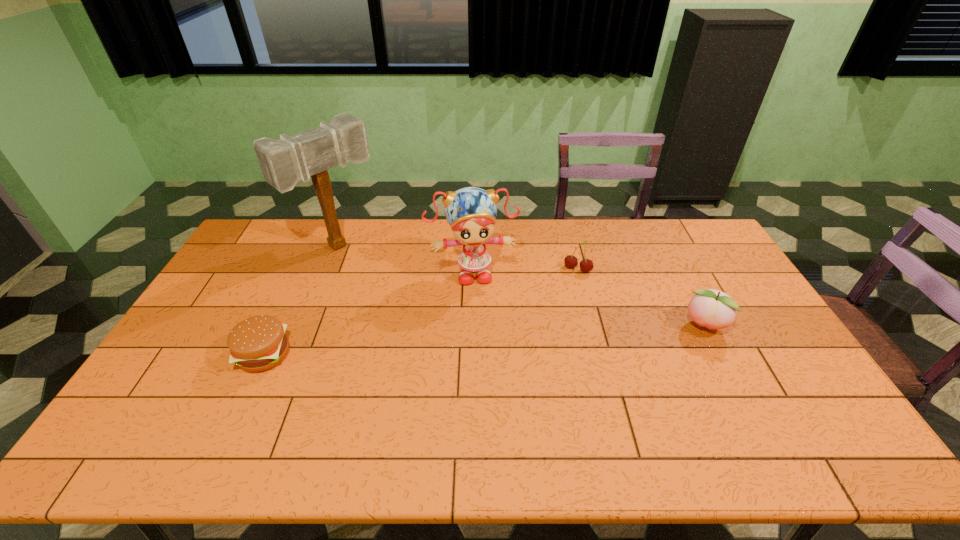
Where is `free space located on the surface of the second object from right to left`? This screenshot has width=960, height=540. free space located on the surface of the second object from right to left is located at coordinates pyautogui.click(x=567, y=286).

Identify the location of free space located on the face of the second tallest object. Image resolution: width=960 pixels, height=540 pixels. [x=480, y=308].

I want to click on free space located on the face of the second tallest object, so pos(491,384).

What are the coordinates of `blank space located 0.320m on the face of the second tallest object` in the screenshot? It's located at (488, 366).

Where is `free space located at the head of the tallest object`? The width and height of the screenshot is (960, 540). free space located at the head of the tallest object is located at coordinates (421, 310).

This screenshot has height=540, width=960. I want to click on vacant space located at the head of the tallest object, so click(x=396, y=291).

Where is `vacant space located 0.340m at the head of the tallest object`? The width and height of the screenshot is (960, 540). vacant space located 0.340m at the head of the tallest object is located at coordinates (423, 312).

The width and height of the screenshot is (960, 540). I want to click on doll that is at the far edge, so click(471, 212).

Locate an element on the screen. mallet that is at the far edge is located at coordinates (283, 162).

At what (x,y) coordinates should I click in order to perform the action: click on object located in the right edge section of the desktop. Please return your answer as a coordinate pair (x, y). The width and height of the screenshot is (960, 540). Looking at the image, I should click on (713, 309).